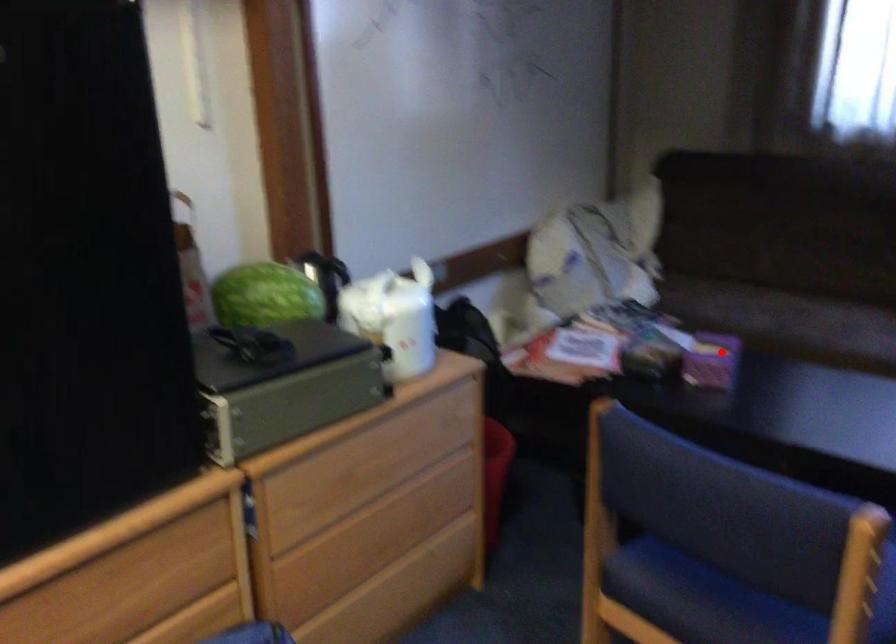
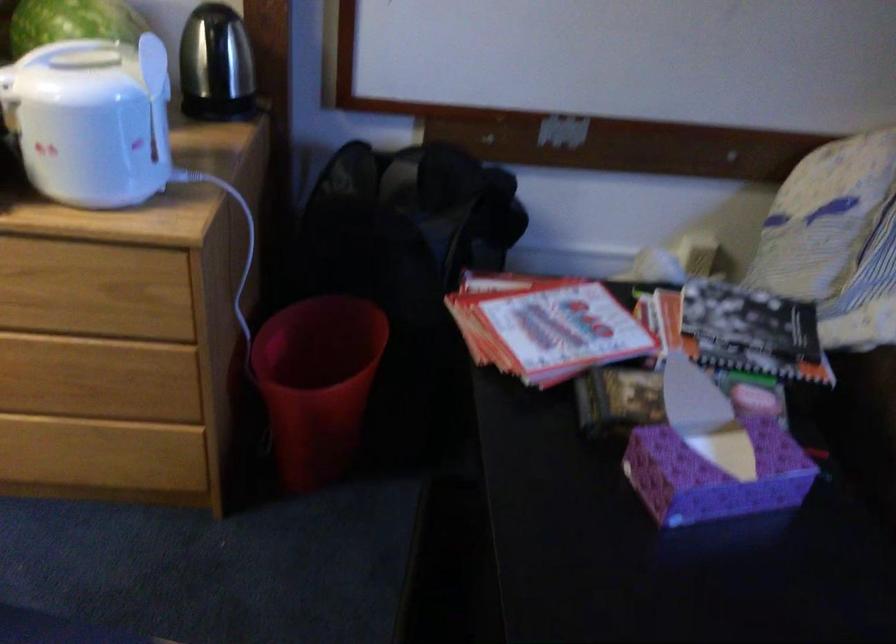
Find the pixel in the second image that matches the highlighted location in the first image.

(714, 475)